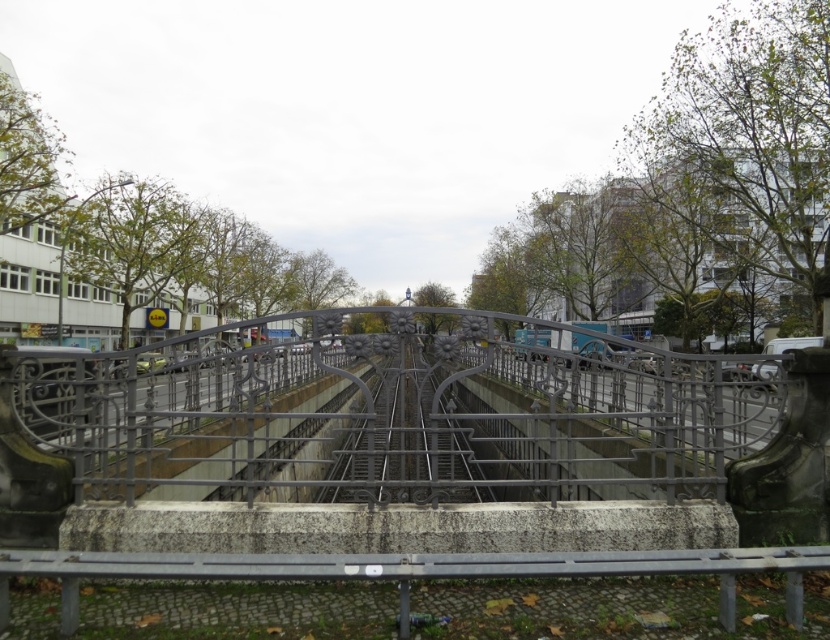
Question: Which of the following is the farthest from the observer?

Choices:
 (A) (540, 330)
 (B) (35, 401)

Answer: (A)

Question: Is polished metal fence at center to the right of metallic silver train at center from the viewer's perspective?

Choices:
 (A) no
 (B) yes

Answer: (A)

Question: Which of the following is the farthest from the observer?

Choices:
 (A) metallic silver train at center
 (B) polished metal fence at center

Answer: (A)

Question: Is polished metal fence at center smaller than metallic silver train at center?

Choices:
 (A) no
 (B) yes

Answer: (A)

Question: Is polished metal fence at center positioned in front of metallic silver train at center?

Choices:
 (A) no
 (B) yes

Answer: (B)

Question: Among these objects, which one is nearest to the camera?

Choices:
 (A) polished metal fence at center
 (B) metallic silver train at center

Answer: (A)